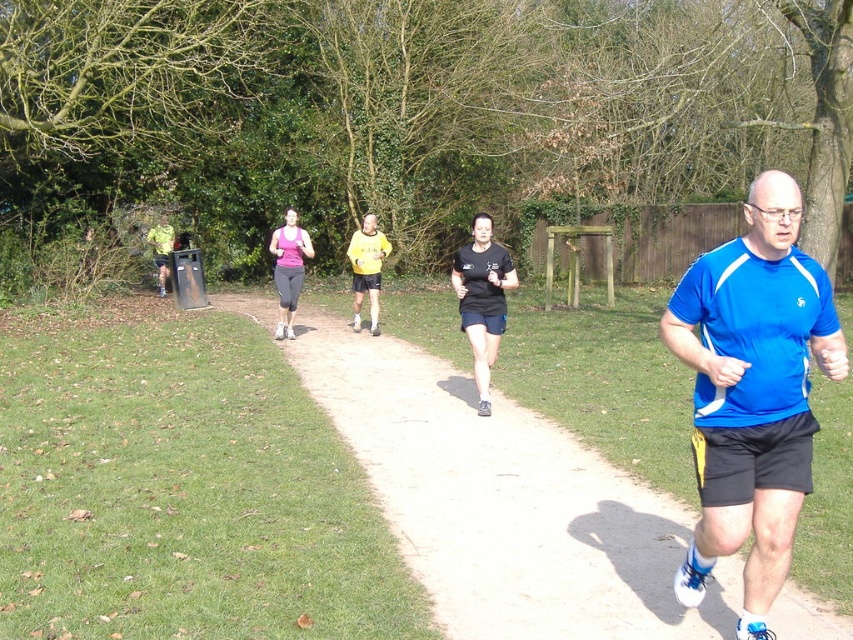
Question: Where is blue fabric runner at center located in relation to blue fabric shirt at center in the image?

Choices:
 (A) above
 (B) below

Answer: (B)

Question: Is blue fabric runner at center in front of matte pink tank top at center?

Choices:
 (A) no
 (B) yes

Answer: (B)

Question: Which of the following is the farthest from the observer?

Choices:
 (A) matte pink tank top at center
 (B) yellow jersey at center

Answer: (B)

Question: Can you confirm if black matte running shoes at center is bigger than matte pink tank top at center?

Choices:
 (A) yes
 (B) no

Answer: (B)

Question: Estimate the real-world distances between objects in this image. Which object is closer to the blue fabric runner at center?

Choices:
 (A) blue fabric shirt at center
 (B) matte pink tank top at center

Answer: (A)

Question: Which point is farther from the camera taking this photo?

Choices:
 (A) (804, 372)
 (B) (370, 220)
 (C) (480, 216)
 (D) (285, 260)

Answer: (B)